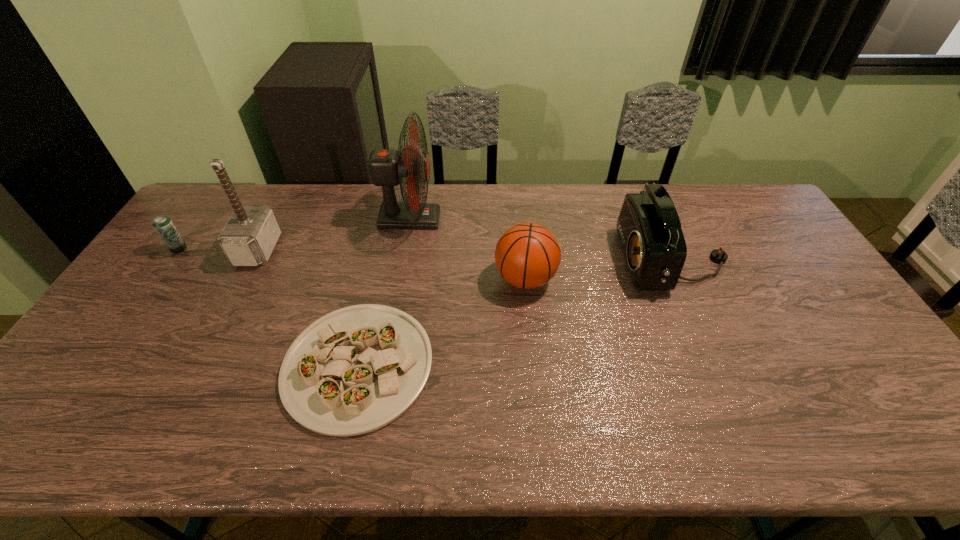
At what (x,y) coordinates should I click in order to perform the action: click on object present at the left edge. Please return your answer as a coordinate pair (x, y). The image size is (960, 540). Looking at the image, I should click on (163, 225).

In order to click on free space at the far edge of the desktop in this screenshot , I will do `click(256, 198)`.

Identify the location of vacant space at the near edge. (165, 418).

In the image, there is a desktop. Where is `vacant space at the left edge`? Image resolution: width=960 pixels, height=540 pixels. vacant space at the left edge is located at coordinates (135, 309).

Find the location of `free space at the right edge`. free space at the right edge is located at coordinates coord(770,272).

Identify the location of vacant area at the far left corner. The width and height of the screenshot is (960, 540). (221, 210).

Locate an element on the screen. unoccupied area between the fan and the shortest object is located at coordinates (384, 292).

Where is `unoccupied area between the fan and the second object from left to right`? The width and height of the screenshot is (960, 540). unoccupied area between the fan and the second object from left to right is located at coordinates (334, 234).

Locate an element on the screen. This screenshot has height=540, width=960. free point between the fan and the hammer is located at coordinates (334, 234).

This screenshot has height=540, width=960. I want to click on free spot between the fourth tallest object and the leftmost object, so click(352, 264).